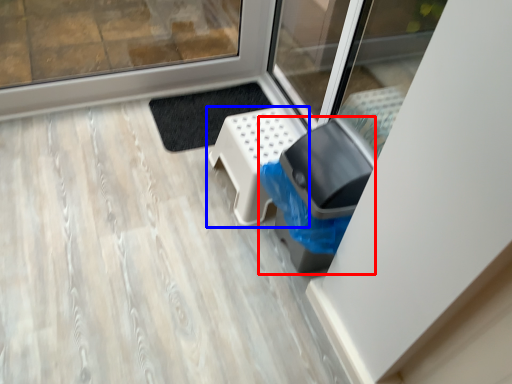
Question: Which of the following is the farthest to the observer, garbage (highlighted by a red box) or furniture (highlighted by a blue box)?

Choices:
 (A) garbage
 (B) furniture

Answer: (B)